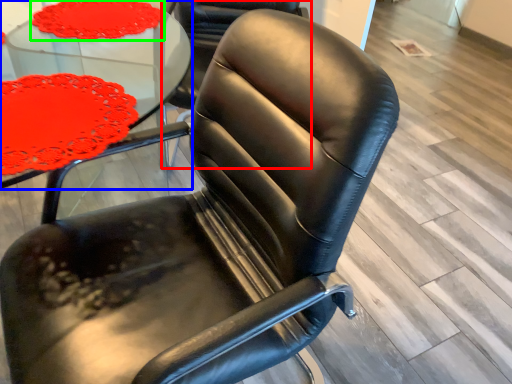
Question: Estimate the real-world distances between objects in this image. Which object is farther from chair (highlighted by a red box), table (highlighted by a blue box) or tablecloth (highlighted by a green box)?

Choices:
 (A) table
 (B) tablecloth

Answer: (B)